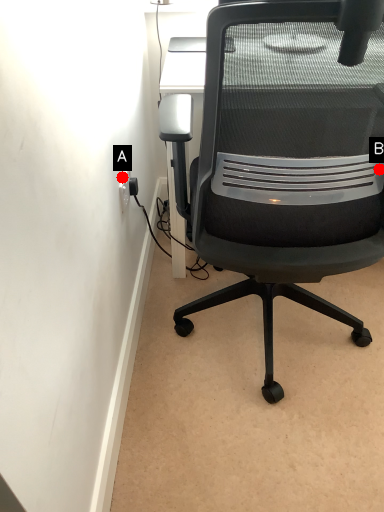
Question: Two points are circled on the image, labeled by A and B beside each circle. Which point is farther from the camera taking this photo?

Choices:
 (A) A is further
 (B) B is further

Answer: (A)